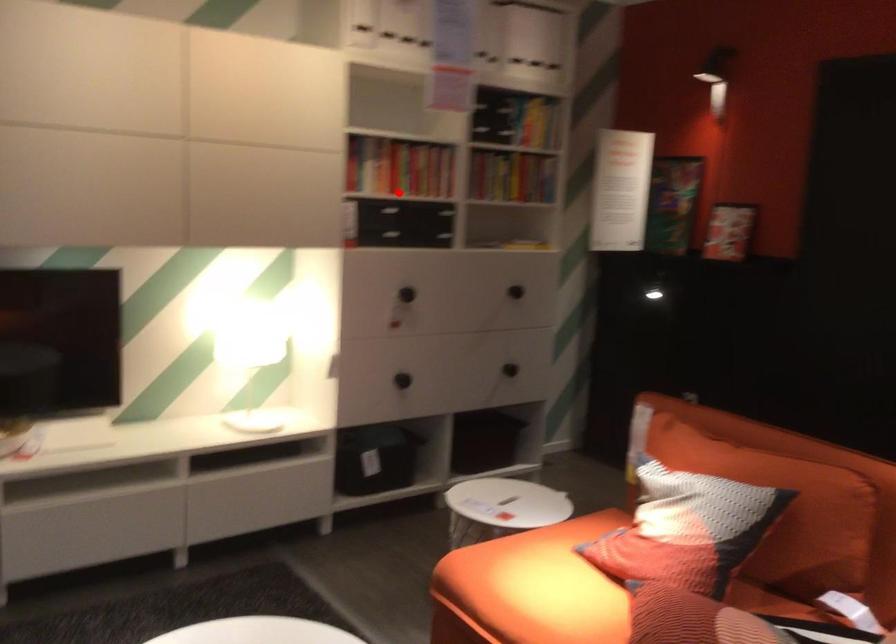
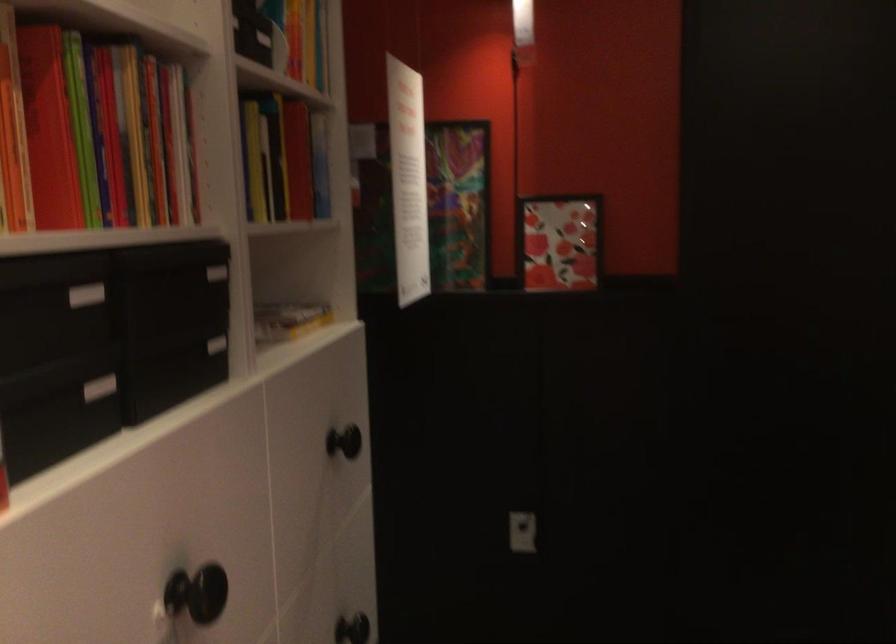
Where in the second image is the point corresponding to the highlighted location from the first image?

(85, 295)